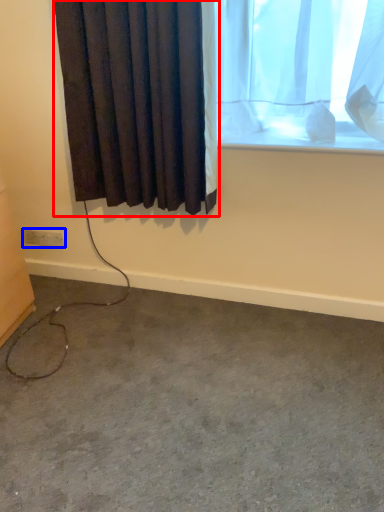
Question: Which point is further to the camera, curtain (highlighted by a red box) or electric outlet (highlighted by a blue box)?

Choices:
 (A) curtain
 (B) electric outlet

Answer: (B)